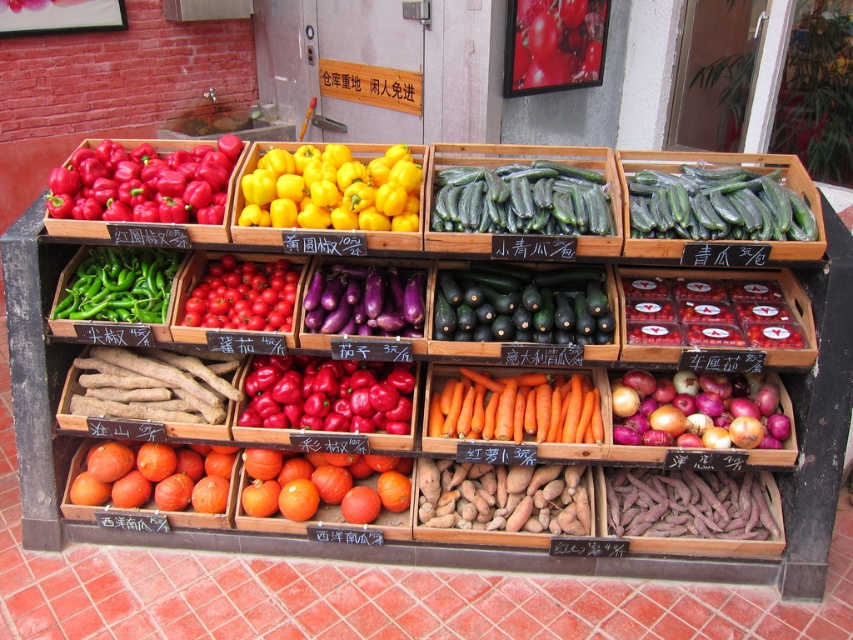
You are a customer at the market stall looking at the produce. You want to find the green smooth skin zucchini at center. What is its exact 2D location in the image?

The green smooth skin zucchini at center is located at the 2D coordinates of point (717,205).

You are a vendor at the market and want to pack items into a box that can only hold items up to 10 cm in width. You have a green smooth skin zucchini at center and a purple matte sweet potato at lower right. Which item should you choose to ensure it fits within the width limit?

The green smooth skin zucchini at center might be wider than purple matte sweet potato at lower right, so to ensure it fits within the 10 cm width limit, you should choose the purple matte sweet potato at lower right.

In the scene shown: You are a customer at the market stall and want to buy both the green smooth skin zucchini at center and the purple matte sweet potato at lower right. Which one is located to the right side of the other?

The green smooth skin zucchini at center is positioned on the right side of purple matte sweet potato at lower right.